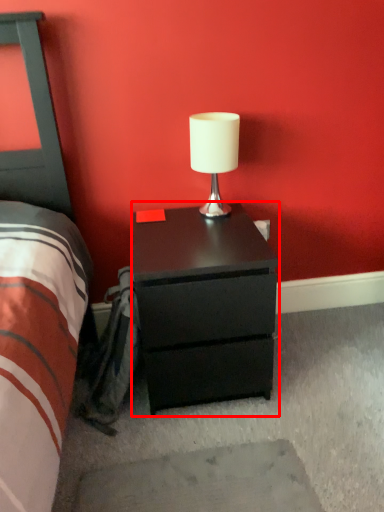
Question: From the image's perspective, where is nightstand (annotated by the red box) located relative to table lamp?

Choices:
 (A) above
 (B) below

Answer: (B)